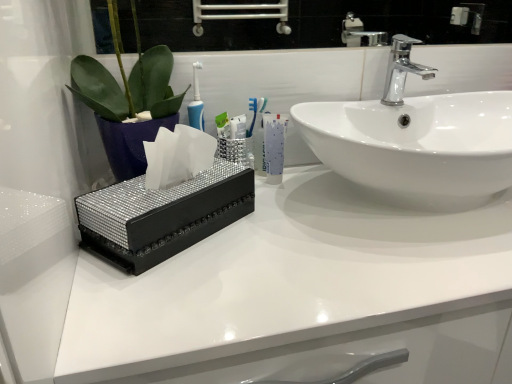
This screenshot has width=512, height=384. I want to click on vacant area that lies to the right of white glossy mouthwash at center, so click(329, 185).